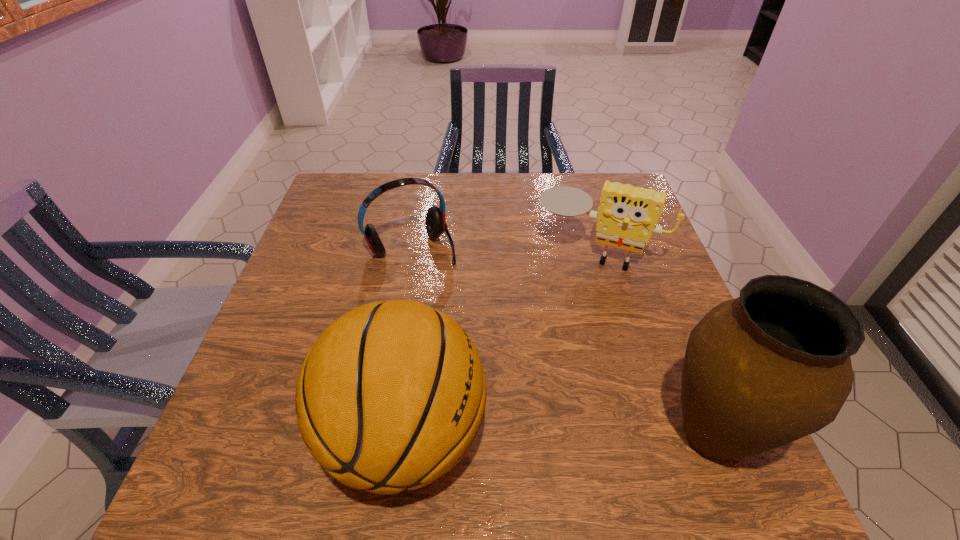
Identify the location of vacant space at the near edge of the desktop. [608, 415].

At what (x,y) coordinates should I click in order to perform the action: click on vacant space at the left edge of the desktop. Please return your answer as a coordinate pair (x, y). The width and height of the screenshot is (960, 540). Looking at the image, I should click on (305, 252).

At what (x,y) coordinates should I click in order to perform the action: click on free space at the right edge. Please return your answer as a coordinate pair (x, y). The width and height of the screenshot is (960, 540). Looking at the image, I should click on (625, 336).

In the image, there is a desktop. Where is `vacant space at the far left corner`? This screenshot has width=960, height=540. vacant space at the far left corner is located at coordinates (346, 214).

Locate an element on the screen. vacant region at the far right corner of the desktop is located at coordinates (594, 176).

Locate an element on the screen. This screenshot has height=540, width=960. empty space that is in between the urn and the basketball is located at coordinates (559, 435).

This screenshot has width=960, height=540. Identify the location of unoccupied position between the sponge and the basketball. (500, 343).

Identify the location of free area in between the headset and the urn. This screenshot has width=960, height=540. (562, 341).

Identify the location of blank region between the basketball and the sponge. The width and height of the screenshot is (960, 540). (500, 343).

Locate an element on the screen. vacant area that lies between the headset and the urn is located at coordinates (562, 341).